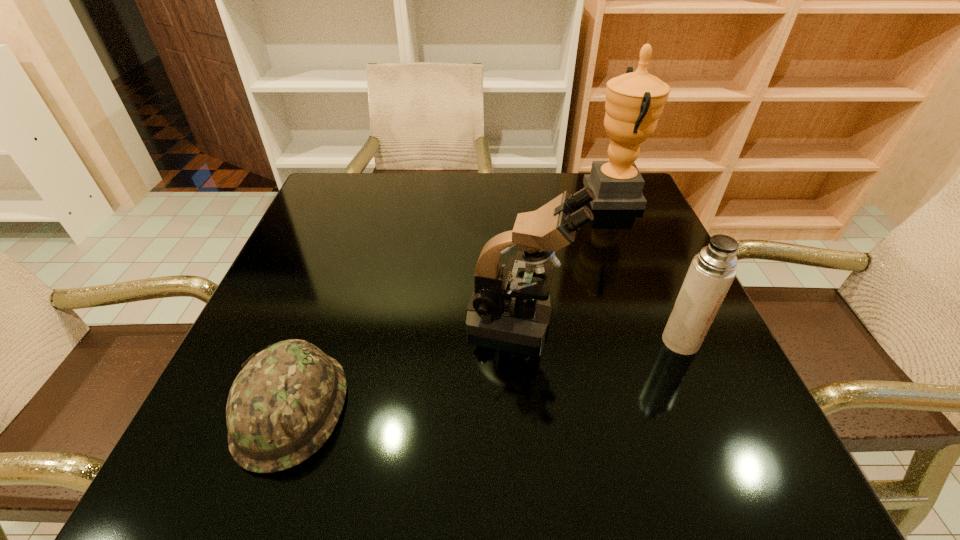
Locate an element on the screen. free point between the farthest object and the third shortest object is located at coordinates (566, 256).

I want to click on unoccupied area between the award and the microscope, so click(x=566, y=256).

The image size is (960, 540). Find the location of `free area in between the second shortest object and the tallest object`. free area in between the second shortest object and the tallest object is located at coordinates (647, 268).

You are a GUI agent. You are given a task and a screenshot of the screen. Output one action in this format:
    pyautogui.click(x=<x>, y=<y>)
    Task: Click on the free space that is in between the thermos bottle and the leftmost object
    
    Given the screenshot: What is the action you would take?
    pyautogui.click(x=486, y=375)

Identify the location of vacant point located between the second tallest object and the tallest object. This screenshot has height=540, width=960. (566, 256).

Identify which object is located as the nearest to the farthest object. Please provide its 2D coordinates. Your answer should be formatted as a tuple, i.e. [(x, y)], where the tuple contains the x and y coordinates of a point satisfying the conditions above.

[(505, 307)]

Identify which object is the closest to the third shortest object. Please provide its 2D coordinates. Your answer should be formatted as a tuple, i.e. [(x, y)], where the tuple contains the x and y coordinates of a point satisfying the conditions above.

[(712, 271)]

The width and height of the screenshot is (960, 540). Find the location of `vacant area that satisfies the following two spatial constraints: 1. at the front of the third tallest object with handles; 2. on the left side of the award`. vacant area that satisfies the following two spatial constraints: 1. at the front of the third tallest object with handles; 2. on the left side of the award is located at coordinates pos(676,341).

Locate an element on the screen. vacant space that satisfies the following two spatial constraints: 1. on the back side of the leftmost object; 2. on the left side of the third shortest object is located at coordinates (323, 318).

Locate an element on the screen. free spot that satisfies the following two spatial constraints: 1. at the front of the award with handles; 2. on the right side of the second shortest object is located at coordinates (676, 341).